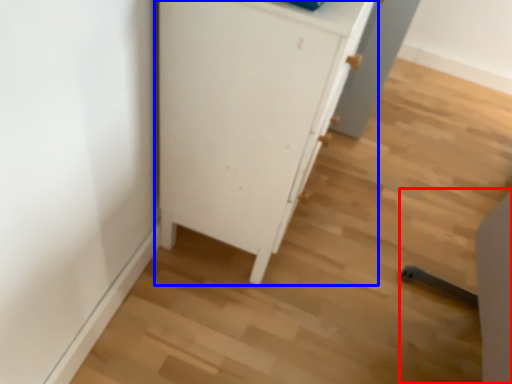
Question: Which object appears closest to the camera in this image, chair (highlighted by a red box) or cupboard (highlighted by a blue box)?

Choices:
 (A) chair
 (B) cupboard

Answer: (A)